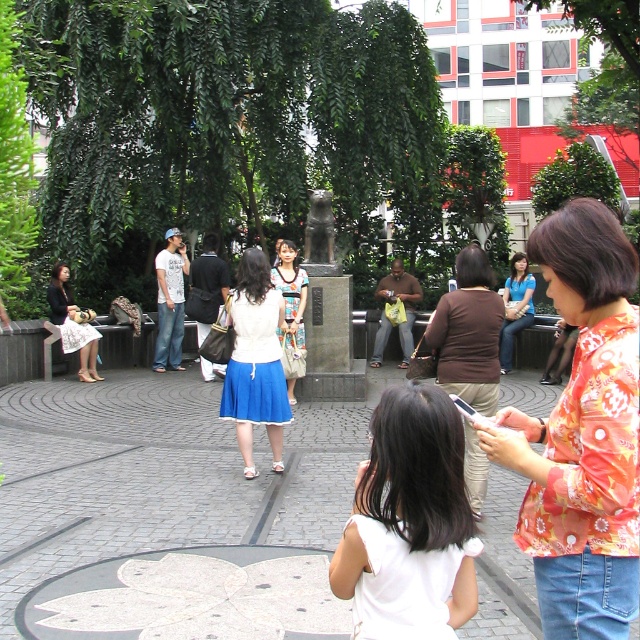
Question: Which of these objects is positioned closest to the white lace dress at center?

Choices:
 (A) white cotton dress at center
 (B) bronze statue at center

Answer: (A)

Question: Based on their relative distances, which object is nearer to the bronze statue at center?

Choices:
 (A) white fabric dress at center
 (B) white cotton dress at center
 (C) floral print shirt at center
 (D) blue fabric shirt at center

Answer: (B)

Question: Which object is closer to the camera taking this photo?

Choices:
 (A) floral print shirt at center
 (B) white fabric dress at center
 (C) white lace dress at center
 (D) white fabric skirt at center

Answer: (B)

Question: Is blue fabric shirt at center further to the viewer compared to bronze statue at center?

Choices:
 (A) no
 (B) yes

Answer: (B)

Question: Is brown fabric skirt at center bigger than blue fabric shirt at center?

Choices:
 (A) yes
 (B) no

Answer: (B)

Question: Can you confirm if white fabric dress at center is bigger than bronze statue at center?

Choices:
 (A) no
 (B) yes

Answer: (A)